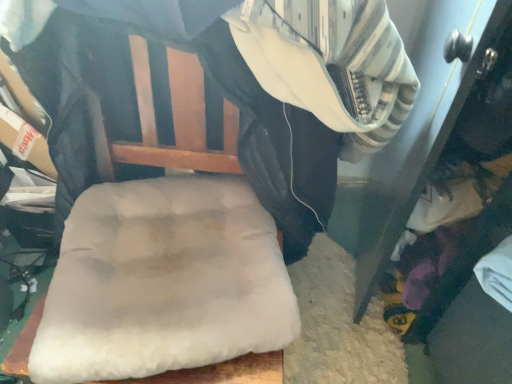
What is the approximate width of white fluffy cushion at center?

white fluffy cushion at center is 20.47 inches wide.

The height and width of the screenshot is (384, 512). Describe the element at coordinates (172, 119) in the screenshot. I see `white fluffy cushion at center` at that location.

Where is `white fluffy cushion at center`? The width and height of the screenshot is (512, 384). white fluffy cushion at center is located at coordinates (172, 119).

At what (x,y) coordinates should I click in order to perform the action: click on white fluffy cushion at center. Please return your answer as a coordinate pair (x, y). The height and width of the screenshot is (384, 512). Looking at the image, I should click on (172, 119).